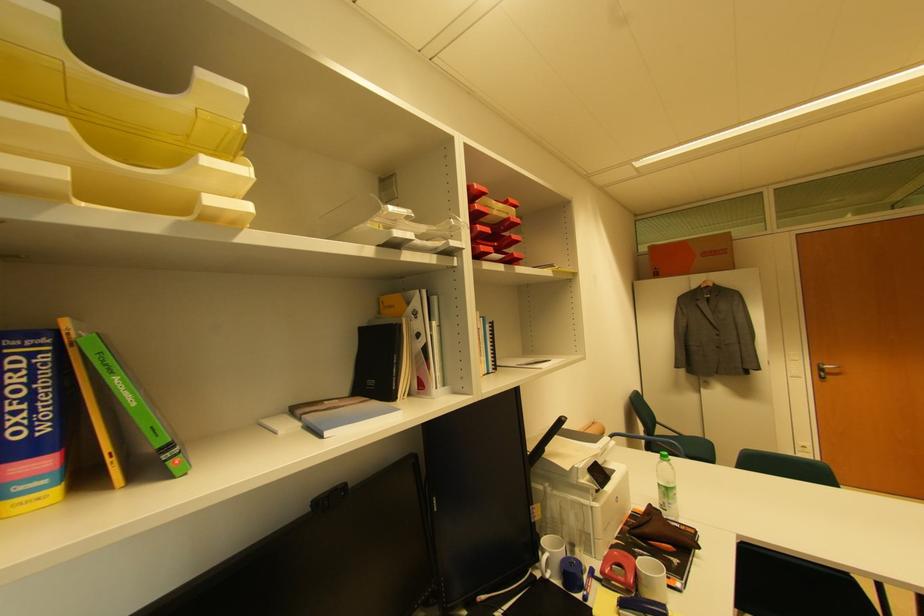
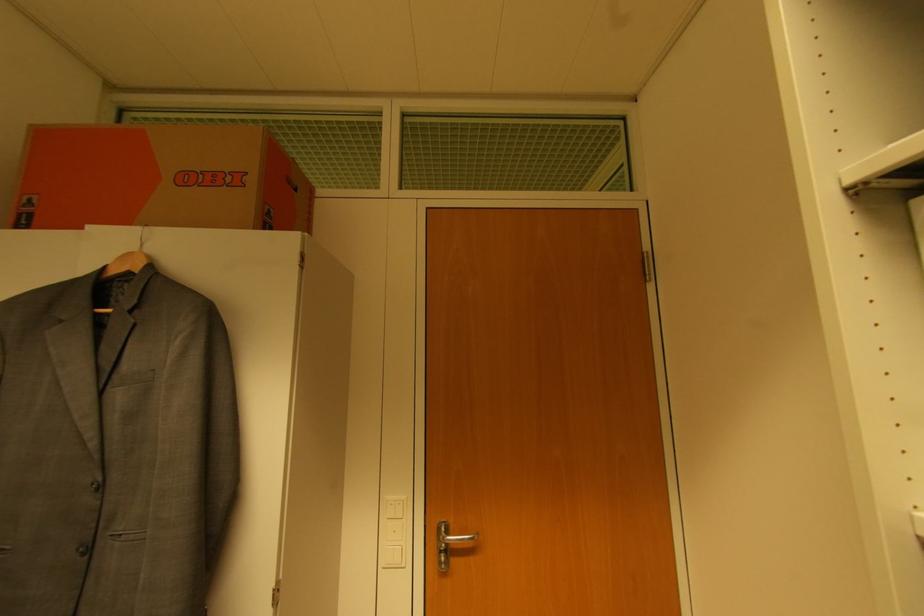
In the second image, find the point that corresponds to [712,286] in the first image.

(137, 270)